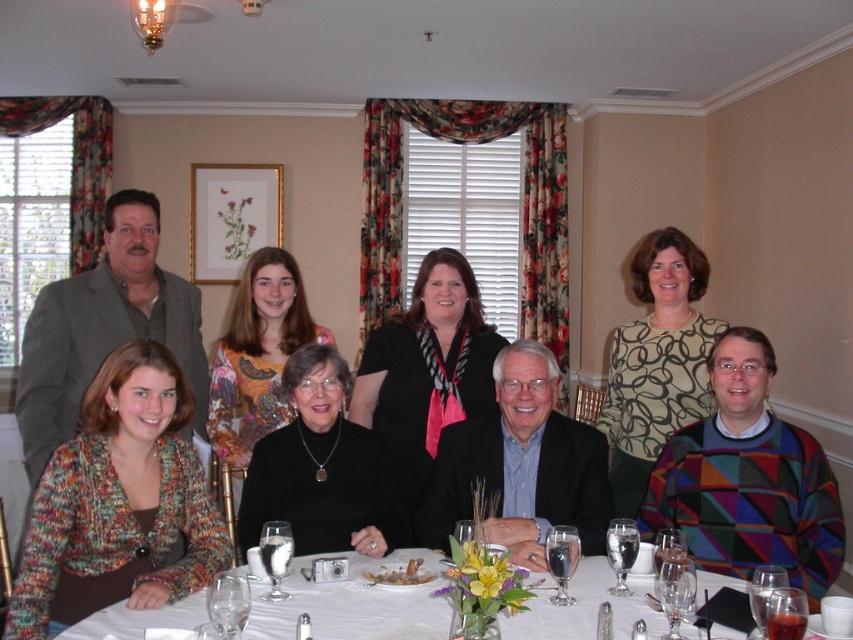
Question: Which point is farther from the camera taking this photo?

Choices:
 (A) (234, 333)
 (B) (386, 522)
 (C) (693, 364)
 (D) (113, 636)

Answer: (A)

Question: Can you confirm if multicolored sweater at lower left is positioned to the left of printed fabric blouse at center?

Choices:
 (A) yes
 (B) no

Answer: (A)

Question: Does multicolored knitted sweater at lower left appear under floral-patterned blouse at center?

Choices:
 (A) yes
 (B) no

Answer: (A)

Question: Which point is farther to the camera?

Choices:
 (A) click(689, 324)
 (B) click(766, 534)

Answer: (A)

Question: Where is white porcelain table at center located in relation to floral-patterned blouse at center in the image?

Choices:
 (A) above
 (B) below

Answer: (B)

Question: Among these objects, which one is farthest from the camera?

Choices:
 (A) multicolored sweater at lower left
 (B) white porcelain table at center
 (C) printed fabric blouse at center
 (D) floral-patterned blouse at center

Answer: (A)